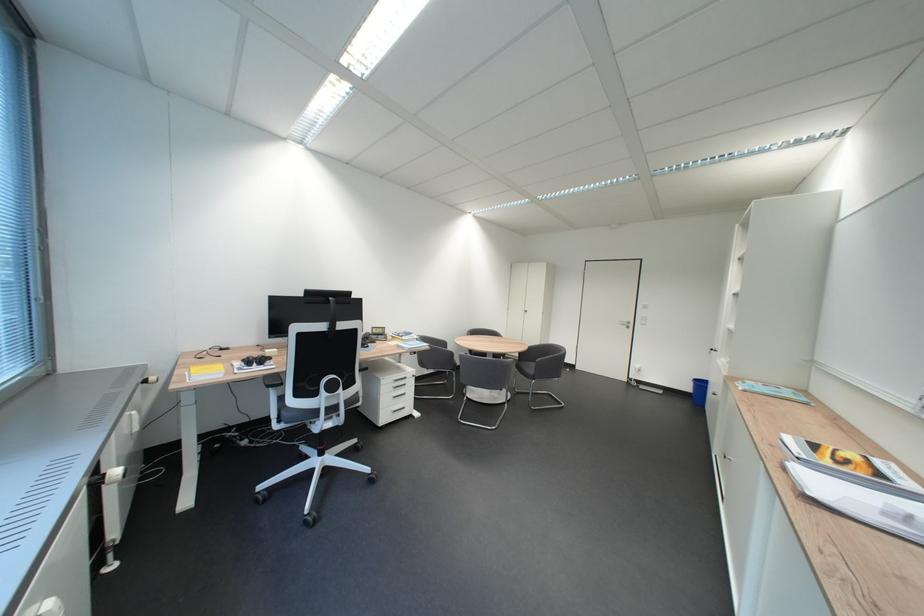
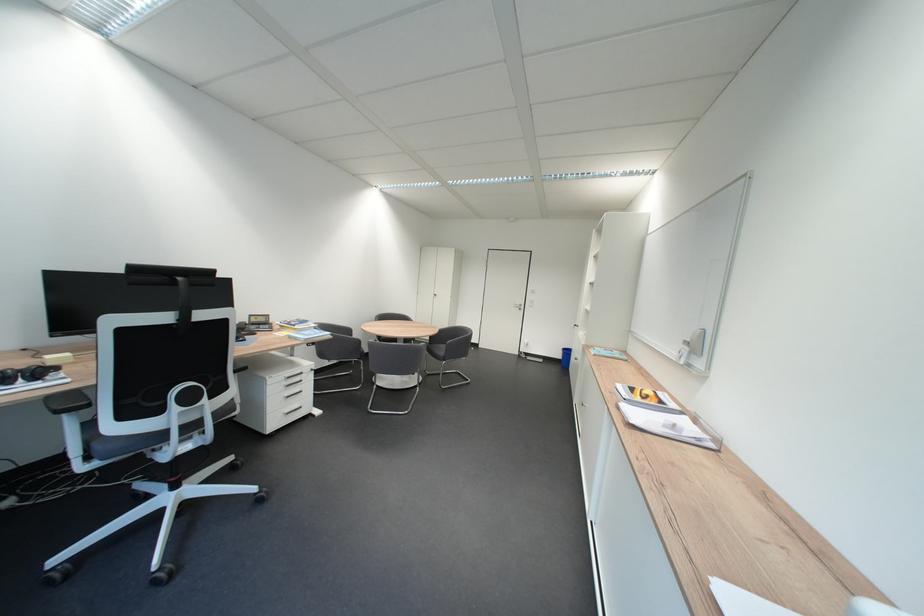
The point at (266, 361) is marked in the first image. Where is the corresponding point in the second image?

(32, 373)